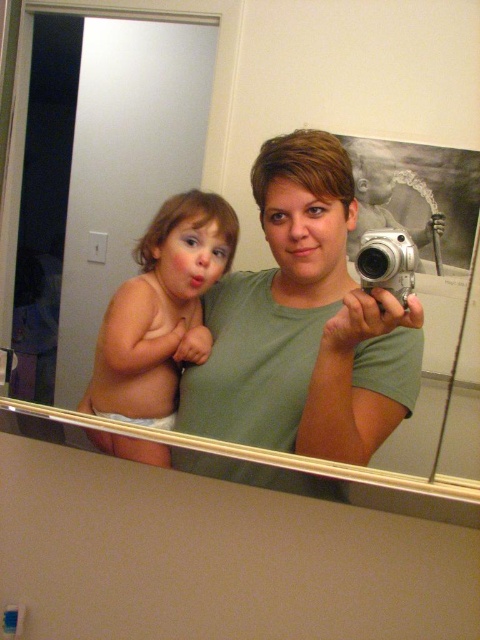
Question: Which of the following is the closest to the observer?

Choices:
 (A) (275, 221)
 (B) (130, 419)
 (C) (148, 308)

Answer: (A)

Question: From the image, what is the correct spatial relationship of smooth skin baby at left in relation to white cloth diaper at lower left?

Choices:
 (A) above
 (B) below

Answer: (A)

Question: Estimate the real-world distances between objects in this image. Which object is closer to the silver metallic camera at center?

Choices:
 (A) smooth skin baby at left
 (B) white cloth diaper at lower left
 (C) matte green shirt at center

Answer: (C)

Question: Does matte green shirt at center appear on the right side of white cloth diaper at lower left?

Choices:
 (A) yes
 (B) no

Answer: (A)

Question: Does matte green shirt at center have a smaller size compared to white cloth diaper at lower left?

Choices:
 (A) yes
 (B) no

Answer: (B)

Question: Which object is closer to the camera taking this photo?

Choices:
 (A) white cloth diaper at lower left
 (B) matte green shirt at center

Answer: (B)